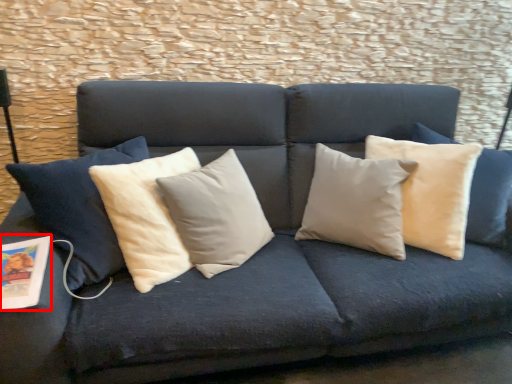
Question: From the image's perspective, considering the relative positions of magazine (annotated by the red box) and pillow in the image provided, where is magazine (annotated by the red box) located with respect to the staircase?

Choices:
 (A) above
 (B) below

Answer: (B)